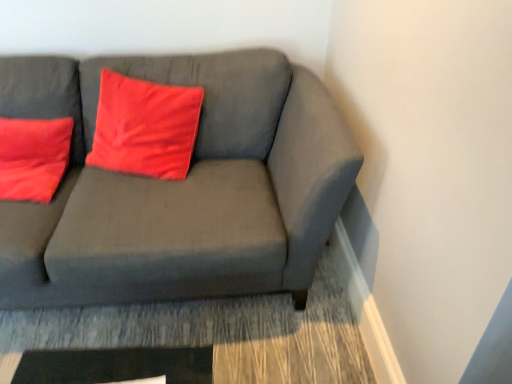
What do you see at coordinates (181, 187) in the screenshot? The width and height of the screenshot is (512, 384). I see `matte gray couch at center` at bounding box center [181, 187].

Measure the distance between matte gray couch at center and camera.

matte gray couch at center and camera are 4.33 feet apart.

Locate an element on the screen. Image resolution: width=512 pixels, height=384 pixels. matte gray couch at center is located at coordinates (181, 187).

The image size is (512, 384). Describe the element at coordinates (145, 127) in the screenshot. I see `matte red pillow at center` at that location.

Find the location of `matte red pillow at center`. matte red pillow at center is located at coordinates (145, 127).

What is the approximate height of matte red pillow at center?

21.24 inches.

At what (x,y) coordinates should I click in order to perform the action: click on matte gray couch at center. Please return your answer as a coordinate pair (x, y). The image size is (512, 384). Looking at the image, I should click on (181, 187).

Which object is positioned more to the right, matte gray couch at center or matte red pillow at center?

matte red pillow at center is more to the right.

Is the position of matte gray couch at center more distant than that of matte red pillow at center?

No, matte gray couch at center is closer to the camera.

Which is more distant, (319, 239) or (122, 85)?

The point (122, 85) is farther.

From the image's perspective, does matte gray couch at center appear lower than matte red pillow at center?

Correct, matte gray couch at center appears lower than matte red pillow at center in the image.

From a real-world perspective, relative to matte red pillow at center, is matte gray couch at center vertically above or below?

Clearly, from a real-world perspective, matte gray couch at center is below matte red pillow at center.

Is matte gray couch at center wider than matte red pillow at center?

Correct, the width of matte gray couch at center exceeds that of matte red pillow at center.

Between matte gray couch at center and matte red pillow at center, which one has more height?

With more height is matte gray couch at center.

Considering the relative sizes of matte gray couch at center and matte red pillow at center in the image provided, is matte gray couch at center smaller than matte red pillow at center?

Actually, matte gray couch at center might be larger than matte red pillow at center.

Is matte gray couch at center inside or outside of matte red pillow at center?

matte gray couch at center lies outside matte red pillow at center.

Is matte gray couch at center next to matte red pillow at center and touching it?

There is a gap between matte gray couch at center and matte red pillow at center.

Could you tell me if matte gray couch at center is turned towards matte red pillow at center?

Yes, matte gray couch at center is facing matte red pillow at center.

What's the angular difference between matte gray couch at center and matte red pillow at center's facing directions?

13.7 degrees separate the facing orientations of matte gray couch at center and matte red pillow at center.

Where is `pillow above the matte gray couch at center (from a real-world perspective)`? pillow above the matte gray couch at center (from a real-world perspective) is located at coordinates (145, 127).

Is matte red pillow at center at the left side of matte gray couch at center?

No, matte red pillow at center is not to the left of matte gray couch at center.

Which object is closer to the camera taking this photo, matte red pillow at center or matte gray couch at center?

matte gray couch at center is closer to the camera.

Considering the positions of point (185, 174) and point (193, 65), is point (185, 174) closer or farther from the camera than point (193, 65)?

Point (185, 174) is positioned closer to the camera compared to point (193, 65).

From the image's perspective, is matte red pillow at center located above matte gray couch at center?

Yes, from the image's perspective, matte red pillow at center is above matte gray couch at center.

From a real-world perspective, who is located lower, matte red pillow at center or matte gray couch at center?

matte gray couch at center, from a real-world perspective.

Between matte red pillow at center and matte gray couch at center, which one has larger width?

Wider between the two is matte gray couch at center.

Is matte red pillow at center shorter than matte gray couch at center?

Indeed, matte red pillow at center has a lesser height compared to matte gray couch at center.

Is matte red pillow at center bigger than matte gray couch at center?

Actually, matte red pillow at center might be smaller than matte gray couch at center.

Is matte red pillow at center not inside matte gray couch at center?

No, matte red pillow at center is not outside of matte gray couch at center.

Is matte red pillow at center not close to matte gray couch at center?

They are positioned close to each other.

Looking at this image, could you tell me if matte red pillow at center is turned towards matte gray couch at center?

Yes.

How different are the orientations of matte red pillow at center and matte gray couch at center in degrees?

13.7 degrees separate the facing orientations of matte red pillow at center and matte gray couch at center.

Locate an element on the screen. The height and width of the screenshot is (384, 512). studio couch below the matte red pillow at center (from a real-world perspective) is located at coordinates (181, 187).

Locate an element on the screen. pillow behind the matte gray couch at center is located at coordinates (145, 127).

Identify the location of studio couch in front of the matte red pillow at center. (181, 187).